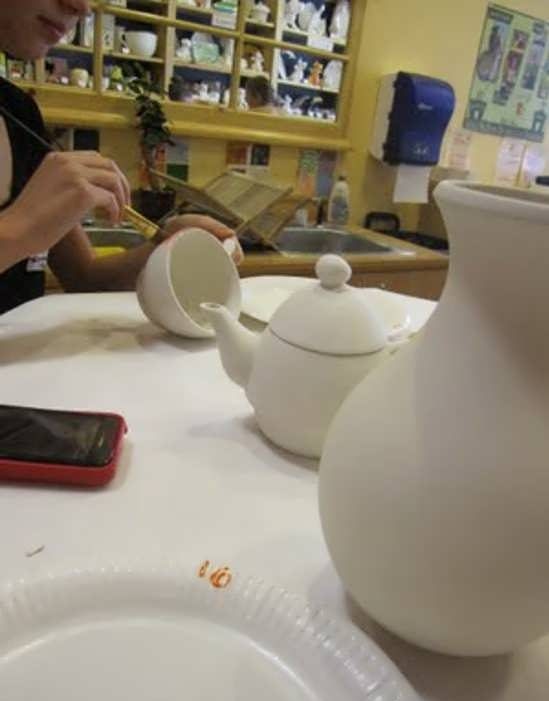
Locate an element on the screen. plate is located at coordinates (159, 644).